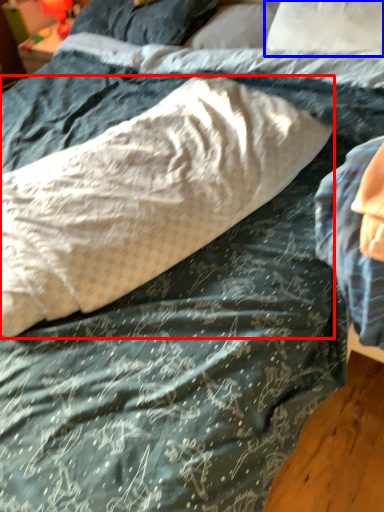
Question: Which object is closer to the camera taking this photo, pillow (highlighted by a red box) or pillow (highlighted by a blue box)?

Choices:
 (A) pillow
 (B) pillow

Answer: (A)